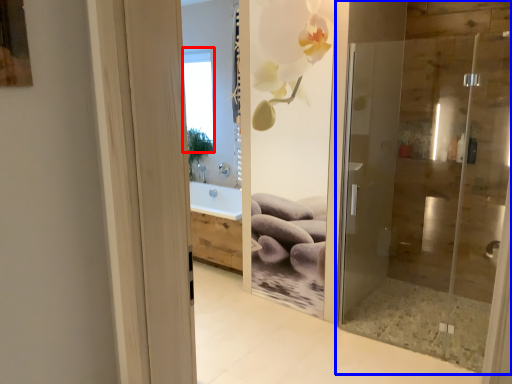
Question: Which object is closer to the camera taking this photo, window (highlighted by a red box) or door (highlighted by a blue box)?

Choices:
 (A) window
 (B) door

Answer: (B)